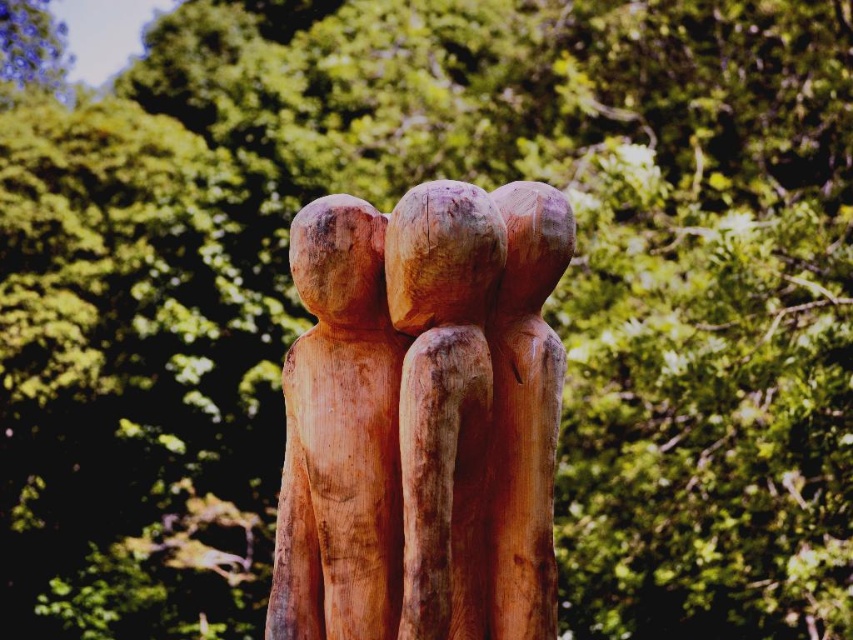
Is natural wood sculpture at center wider than natural wood figure at center?

Yes.

Between natural wood sculpture at center and natural wood figure at center, which one is positioned higher?

natural wood sculpture at center

The height and width of the screenshot is (640, 853). I want to click on natural wood sculpture at center, so click(x=422, y=417).

Where is `natural wood sculpture at center`? Image resolution: width=853 pixels, height=640 pixels. natural wood sculpture at center is located at coordinates (422, 417).